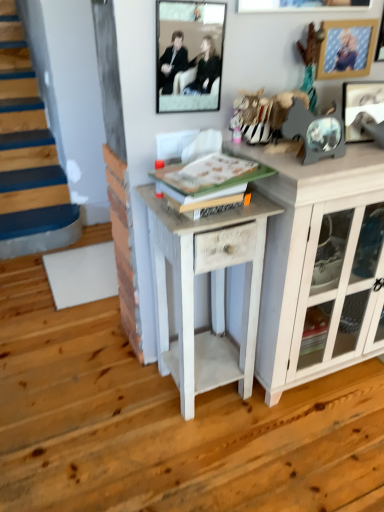
Question: Which direction should I rotate to face matte black frame at upper center, positioned as the 1th picture frame in left-to-right order, — up or down?

Choices:
 (A) up
 (B) down

Answer: (A)

Question: Is metallic silver picture frame at upper right, the 3th picture frame when ordered from left to right, not inside white wood cabinet at right?

Choices:
 (A) no
 (B) yes

Answer: (B)

Question: Considering the relative sizes of metallic silver picture frame at upper right, the 3th picture frame when ordered from left to right, and white wood cabinet at right in the image provided, is metallic silver picture frame at upper right, the 3th picture frame when ordered from left to right, taller than white wood cabinet at right?

Choices:
 (A) no
 (B) yes

Answer: (A)

Question: From the image's perspective, would you say metallic silver picture frame at upper right, positioned as the 1th picture frame in right-to-left order, is shown under white wood cabinet at right?

Choices:
 (A) yes
 (B) no

Answer: (B)

Question: Is metallic silver picture frame at upper right, the 3th picture frame when ordered from left to right, oriented away from white wood cabinet at right?

Choices:
 (A) no
 (B) yes

Answer: (A)

Question: Does metallic silver picture frame at upper right, positioned as the 1th picture frame in right-to-left order, contain white wood cabinet at right?

Choices:
 (A) yes
 (B) no

Answer: (B)

Question: Does metallic silver picture frame at upper right, the 3th picture frame when ordered from left to right, have a lesser width compared to white wood cabinet at right?

Choices:
 (A) no
 (B) yes

Answer: (B)

Question: Would you say white painted wood side table at center is outside metallic silver picture frame at upper right, the 3th picture frame when ordered from left to right?

Choices:
 (A) no
 (B) yes

Answer: (B)

Question: Can you confirm if white painted wood side table at center is bigger than metallic silver picture frame at upper right, positioned as the 1th picture frame in right-to-left order?

Choices:
 (A) yes
 (B) no

Answer: (A)

Question: Is white painted wood side table at center aimed at metallic silver picture frame at upper right, the 3th picture frame when ordered from left to right?

Choices:
 (A) yes
 (B) no

Answer: (B)

Question: From the image's perspective, is white painted wood side table at center on top of metallic silver picture frame at upper right, the 3th picture frame when ordered from left to right?

Choices:
 (A) yes
 (B) no

Answer: (B)

Question: From a real-world perspective, is white painted wood side table at center under metallic silver picture frame at upper right, positioned as the 1th picture frame in right-to-left order?

Choices:
 (A) yes
 (B) no

Answer: (A)

Question: Does white painted wood side table at center come in front of metallic silver picture frame at upper right, positioned as the 1th picture frame in right-to-left order?

Choices:
 (A) yes
 (B) no

Answer: (A)

Question: From a real-world perspective, does wooden picture frame at upper right, acting as the second picture frame starting from the left, stand above metallic silver picture frame at upper right, positioned as the 1th picture frame in right-to-left order?

Choices:
 (A) no
 (B) yes

Answer: (B)